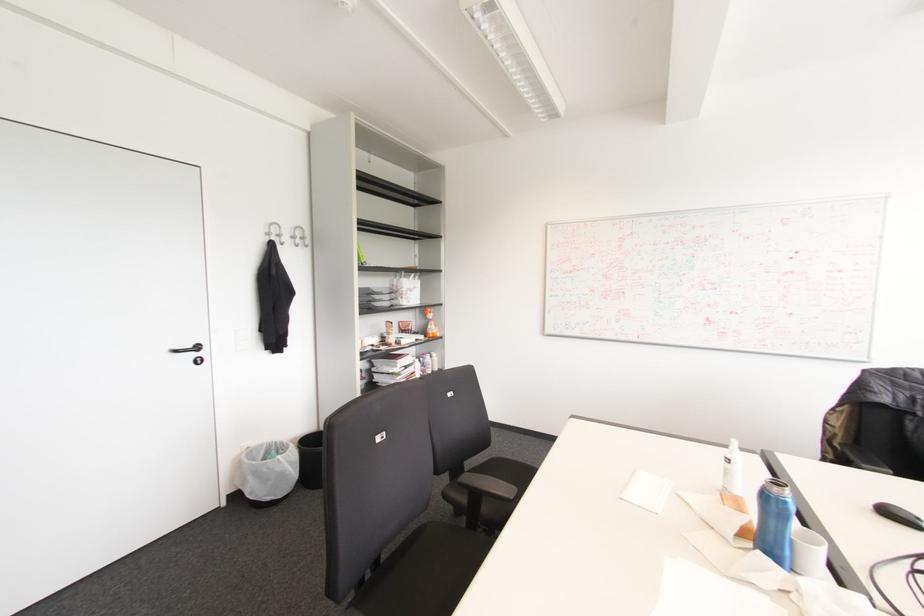
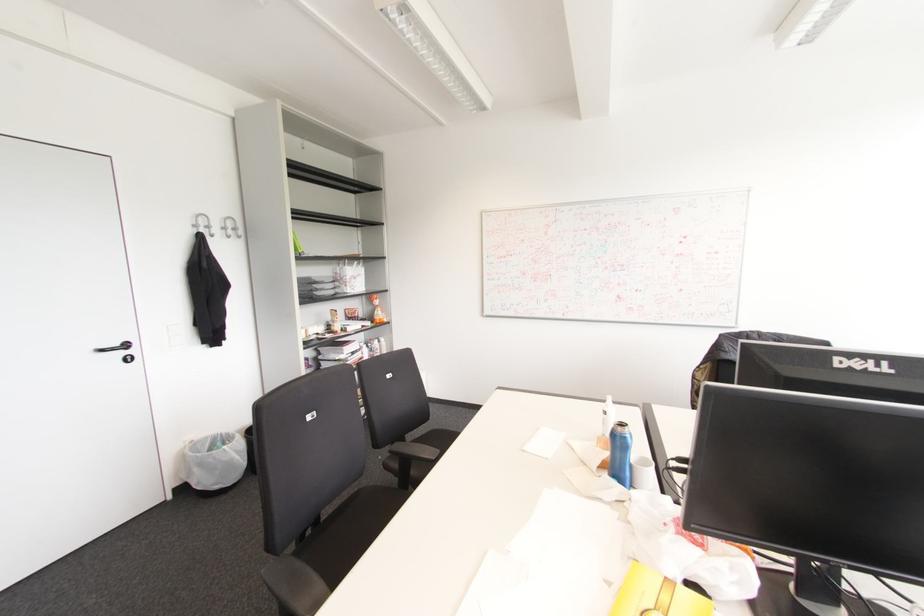
The point at (784, 503) is marked in the first image. Where is the corresponding point in the second image?

(625, 438)